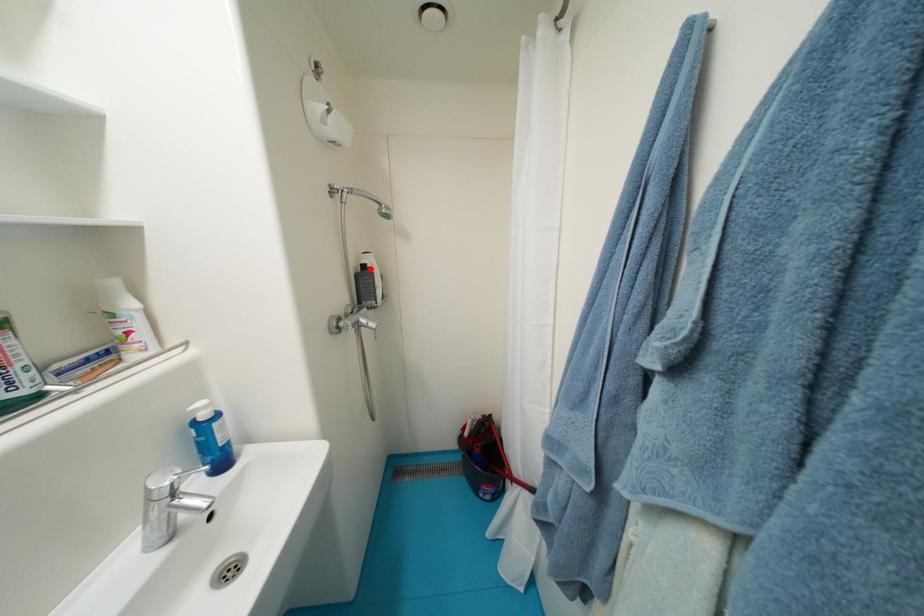
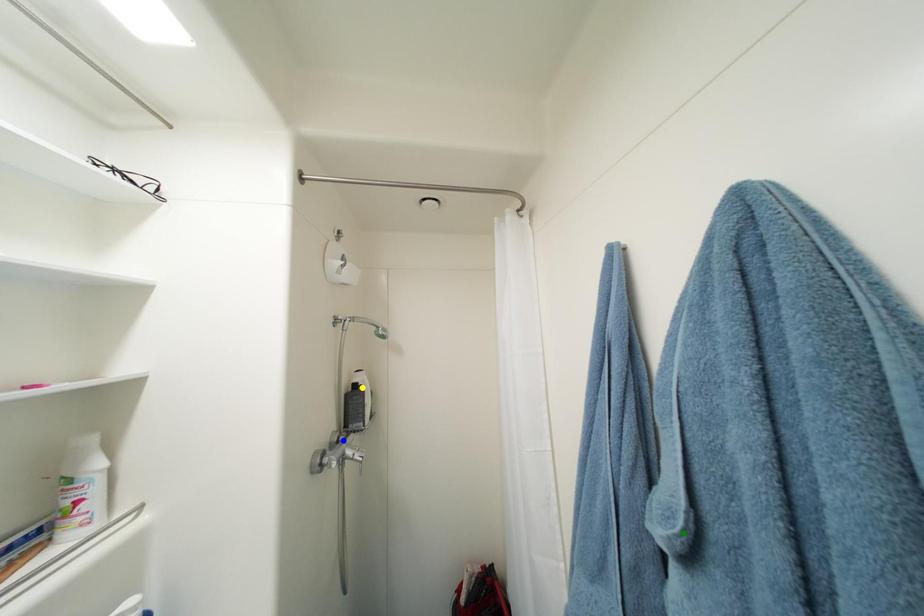
Question: I am providing you with two images of the same scene from different viewpoints. A red point is marked on the first image. You are given multiple points on the second image. Which point in image 2 is actually the same real-world point as the red point in image 1?

Choices:
 (A) yellow point
 (B) blue point
 (C) green point

Answer: (A)